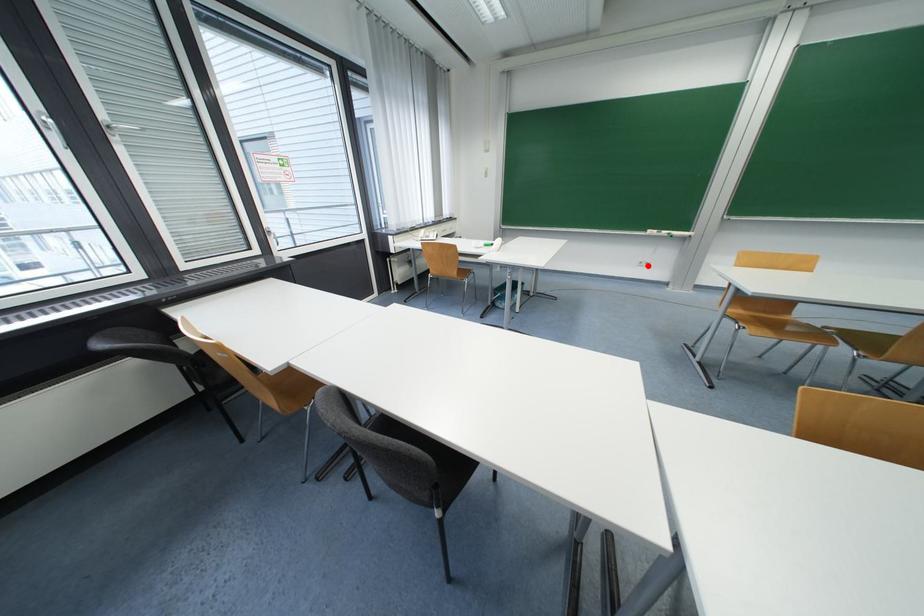
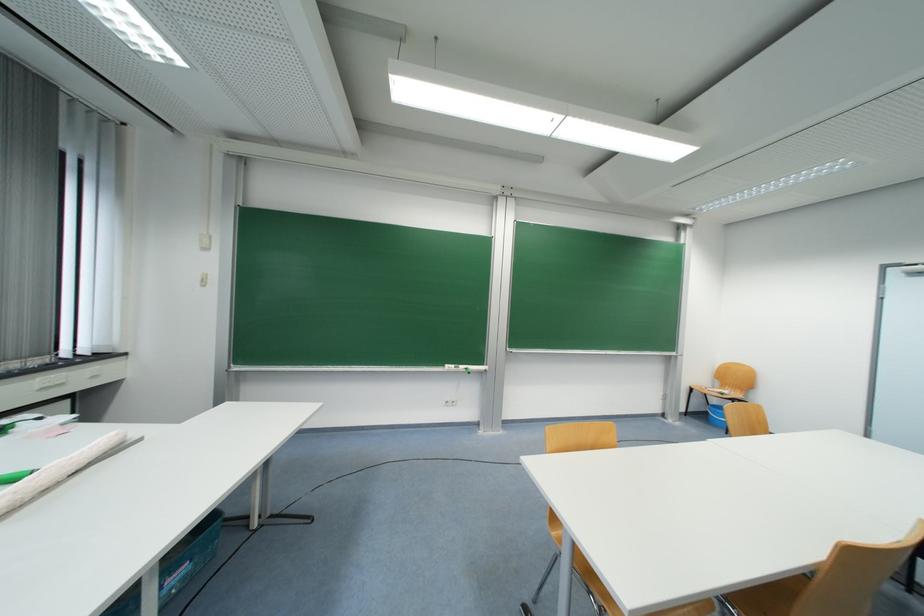
In the second image, find the point that corresponds to the highlighted location in the first image.

(455, 406)